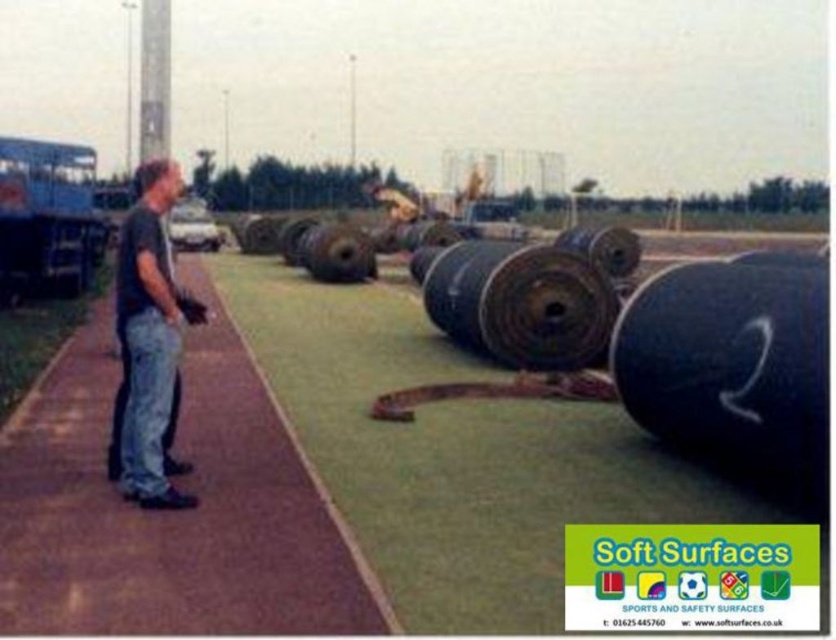
Is brown rubber path at center in front of black rubber tire at center?

That is True.

Find the location of `brown rubber path at center`. brown rubber path at center is located at coordinates (172, 513).

Where is `brown rubber path at center`? brown rubber path at center is located at coordinates (172, 513).

Consider the image. Who is taller, dark blue t-shirt at left or black rubber tire at center?

dark blue t-shirt at left

Can you confirm if dark blue t-shirt at left is positioned to the right of black rubber tire at center?

In fact, dark blue t-shirt at left is to the left of black rubber tire at center.

Between point (161, 198) and point (355, 244), which one is positioned behind?

The point (355, 244) is behind.

Locate an element on the screen. This screenshot has width=836, height=640. dark blue t-shirt at left is located at coordinates (151, 340).

Who is positioned more to the left, brown rubber path at center or dark blue t-shirt at left?

Positioned to the left is brown rubber path at center.

Does brown rubber path at center have a lesser width compared to dark blue t-shirt at left?

No, brown rubber path at center is not thinner than dark blue t-shirt at left.

Find the location of a particular element. brown rubber path at center is located at coordinates (172, 513).